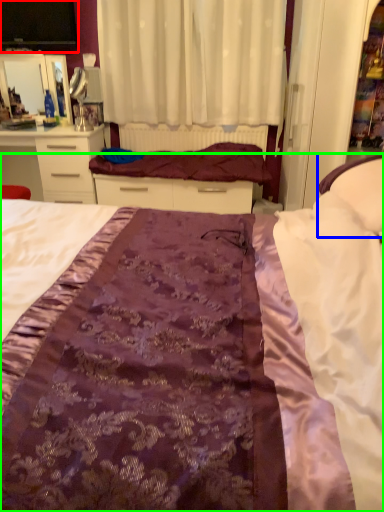
Question: Which object is positioned farthest from desktop (highlighted by a red box)? Select from pillow (highlighted by a blue box) and bed (highlighted by a green box).

Choices:
 (A) pillow
 (B) bed

Answer: (B)